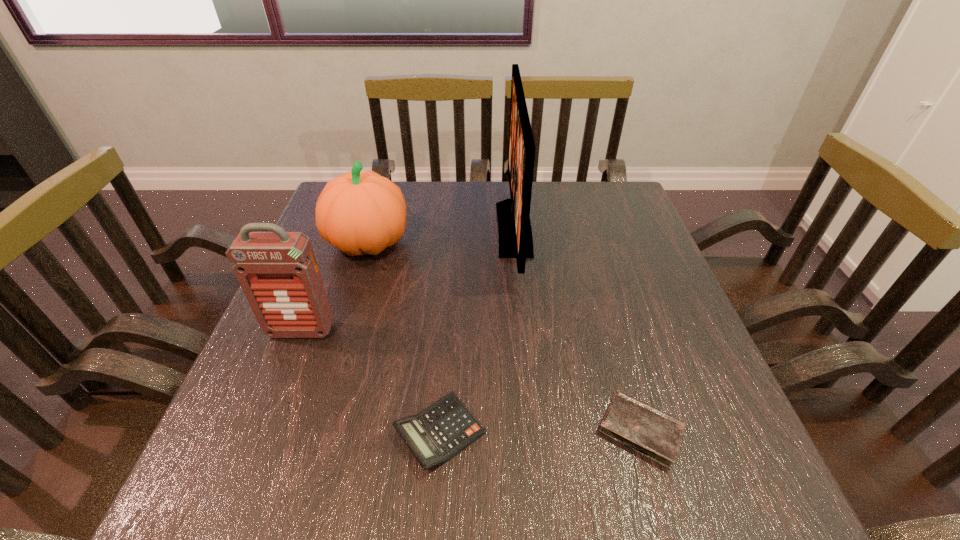
Find the location of `object that is the second closest one to the diary`. object that is the second closest one to the diary is located at coordinates (514, 227).

Locate an element on the screen. The height and width of the screenshot is (540, 960). vacant point that satisfies the following two spatial constraints: 1. on the front-facing side of the shortest object; 2. on the right side of the second tallest object is located at coordinates (262, 430).

Where is `blank space that satisfies the following two spatial constraints: 1. on the front-facing side of the third object from right to left; 2. on the right side of the second tallest object`? blank space that satisfies the following two spatial constraints: 1. on the front-facing side of the third object from right to left; 2. on the right side of the second tallest object is located at coordinates (261, 433).

This screenshot has height=540, width=960. I want to click on free location that satisfies the following two spatial constraints: 1. on the front side of the shortest object; 2. on the right side of the third shortest object, so click(x=310, y=430).

This screenshot has width=960, height=540. Find the location of `free point that satisfies the following two spatial constraints: 1. on the front-facing side of the rightmost object; 2. on the right side of the second object from right to left`. free point that satisfies the following two spatial constraints: 1. on the front-facing side of the rightmost object; 2. on the right side of the second object from right to left is located at coordinates (534, 430).

Where is `free location that satisfies the following two spatial constraints: 1. on the front-facing side of the second object from right to left; 2. on the left side of the rightmost object`? The width and height of the screenshot is (960, 540). free location that satisfies the following two spatial constraints: 1. on the front-facing side of the second object from right to left; 2. on the left side of the rightmost object is located at coordinates (534, 430).

Find the location of a particular element. The width and height of the screenshot is (960, 540). vacant area that satisfies the following two spatial constraints: 1. on the front-facing side of the first-aid kit; 2. on the left side of the calculator is located at coordinates (261, 433).

Find the location of `vacant space that satisfies the following two spatial constraints: 1. on the front side of the pumpkin; 2. on the right side of the shortest object`. vacant space that satisfies the following two spatial constraints: 1. on the front side of the pumpkin; 2. on the right side of the shortest object is located at coordinates pyautogui.click(x=310, y=430).

Where is `free space that satisfies the following two spatial constraints: 1. on the front-facing side of the fourth object from left to right; 2. on the front-facing side of the fourth shortest object`? The image size is (960, 540). free space that satisfies the following two spatial constraints: 1. on the front-facing side of the fourth object from left to right; 2. on the front-facing side of the fourth shortest object is located at coordinates (524, 330).